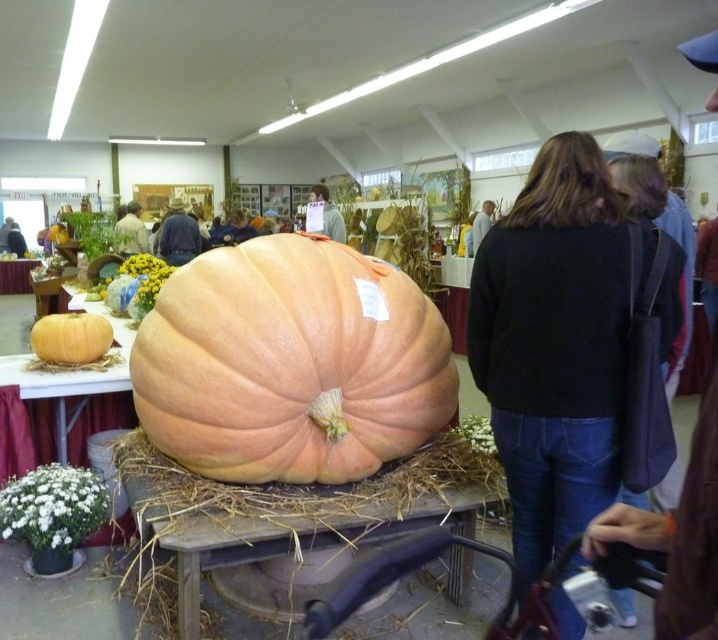
You are a visitor at the exhibition hall and want to place a 5 meter long banner between the wooden table at center and the dark blue fabric at center. Can the banner fit between them?

The wooden table at center is 5.27 meters from the dark blue fabric at center, so yes, the 5 meter long banner can fit between them since the distance is slightly longer than the banner.

You are standing in the exhibition hall and want to take a photo of the matte orange pumpkin at center without any people in the background. Since the light brown hair at center is blocking the view, can you move the pumpkin or the hair to get a clear shot?

The matte orange pumpkin at center is in front of light brown hair at center. Since you can move the pumpkin, you should move the matte orange pumpkin at center to a position where it is not blocked by the light brown hair at center to get a clear photo.

You are a photographer positioned at the back of the exhibition hall. You need to take a photo of the matte orange pumpkin at center and the light brown hair at center. Based on their heights, which object should you adjust your camera angle to focus on first?

The light brown hair at center is taller than the matte orange pumpkin at center, so you should adjust your camera angle to focus on the light brown hair at center first to ensure it is in frame with the pumpkin.